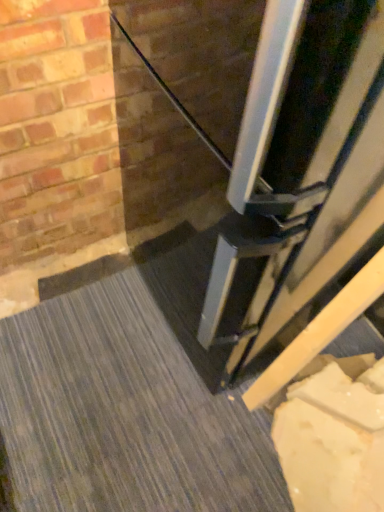
The width and height of the screenshot is (384, 512). What do you see at coordinates (124, 413) in the screenshot?
I see `white matte concrete at lower right` at bounding box center [124, 413].

Measure the distance between white matte concrete at lower right and camera.

→ white matte concrete at lower right and camera are 3.36 feet apart from each other.

This screenshot has width=384, height=512. I want to click on white matte concrete at lower right, so click(124, 413).

The height and width of the screenshot is (512, 384). Describe the element at coordinates (294, 139) in the screenshot. I see `black glossy door at lower center` at that location.

This screenshot has height=512, width=384. Find the location of `black glossy door at lower center`. black glossy door at lower center is located at coordinates (294, 139).

Identify the location of white matte concrete at lower right. (124, 413).

Between white matte concrete at lower right and black glossy door at lower center, which one appears on the left side from the viewer's perspective?

white matte concrete at lower right is more to the left.

Which object is closer to the camera taking this photo, white matte concrete at lower right or black glossy door at lower center?

black glossy door at lower center.

Considering the positions of point (68, 402) and point (305, 168), is point (68, 402) closer or farther from the camera than point (305, 168)?

Point (68, 402).

From the image's perspective, who appears lower, white matte concrete at lower right or black glossy door at lower center?

white matte concrete at lower right.

From the picture: From a real-world perspective, who is located lower, white matte concrete at lower right or black glossy door at lower center?

white matte concrete at lower right.

Considering the sizes of white matte concrete at lower right and black glossy door at lower center in the image, is white matte concrete at lower right wider or thinner than black glossy door at lower center?

Considering their sizes, white matte concrete at lower right looks broader than black glossy door at lower center.

Consider the image. Does white matte concrete at lower right have a greater height compared to black glossy door at lower center?

No, white matte concrete at lower right is not taller than black glossy door at lower center.

Who is smaller, white matte concrete at lower right or black glossy door at lower center?

With smaller size is white matte concrete at lower right.

Is white matte concrete at lower right inside or outside of black glossy door at lower center?

white matte concrete at lower right is spatially situated outside black glossy door at lower center.

Based on the photo, would you say white matte concrete at lower right is a long distance from black glossy door at lower center?

No, white matte concrete at lower right is not far away from black glossy door at lower center.

Is white matte concrete at lower right positioned with its back to black glossy door at lower center?

white matte concrete at lower right does not have its back to black glossy door at lower center.

In the scene shown: How different are the orientations of white matte concrete at lower right and black glossy door at lower center in degrees?

There is a 180-degree angle between the facing directions of white matte concrete at lower right and black glossy door at lower center.

How much distance is there between white matte concrete at lower right and black glossy door at lower center?

24.26 inches.

Identify the location of door above the white matte concrete at lower right (from the image's perspective). The image size is (384, 512). 294,139.

Between black glossy door at lower center and white matte concrete at lower right, which one appears on the left side from the viewer's perspective?

white matte concrete at lower right is more to the left.

Is black glossy door at lower center positioned in front of white matte concrete at lower right?

That is True.

Is point (242, 332) positioned in front of point (99, 484)?

No.

From the image's perspective, relative to white matte concrete at lower right, is black glossy door at lower center above or below?

black glossy door at lower center is above white matte concrete at lower right.

From a real-world perspective, which object stands above the other?

In real-world perspective, black glossy door at lower center is above.

From the picture: Which object is thinner, black glossy door at lower center or white matte concrete at lower right?

With smaller width is black glossy door at lower center.

Between black glossy door at lower center and white matte concrete at lower right, which one has less height?

white matte concrete at lower right.

Considering the sizes of black glossy door at lower center and white matte concrete at lower right in the image, is black glossy door at lower center bigger or smaller than white matte concrete at lower right?

black glossy door at lower center is bigger than white matte concrete at lower right.

Consider the image. Would you say white matte concrete at lower right is part of black glossy door at lower center's contents?

No.

Is black glossy door at lower center directly adjacent to white matte concrete at lower right?

No, black glossy door at lower center is not beside white matte concrete at lower right.

Is black glossy door at lower center aimed at white matte concrete at lower right?

No, black glossy door at lower center is not turned towards white matte concrete at lower right.

How many degrees apart are the facing directions of black glossy door at lower center and white matte concrete at lower right?

They differ by 180 degrees in their facing directions.

Locate an element on the screen. The width and height of the screenshot is (384, 512). concrete that appears behind the black glossy door at lower center is located at coordinates (124, 413).

You are a GUI agent. You are given a task and a screenshot of the screen. Output one action in this format:
    pyautogui.click(x=<x>, y=<y>)
    Task: Click on the door on the right of white matte concrete at lower right
    
    Given the screenshot: What is the action you would take?
    pyautogui.click(x=294, y=139)

The image size is (384, 512). Identify the location of door above the white matte concrete at lower right (from a real-world perspective). (294, 139).